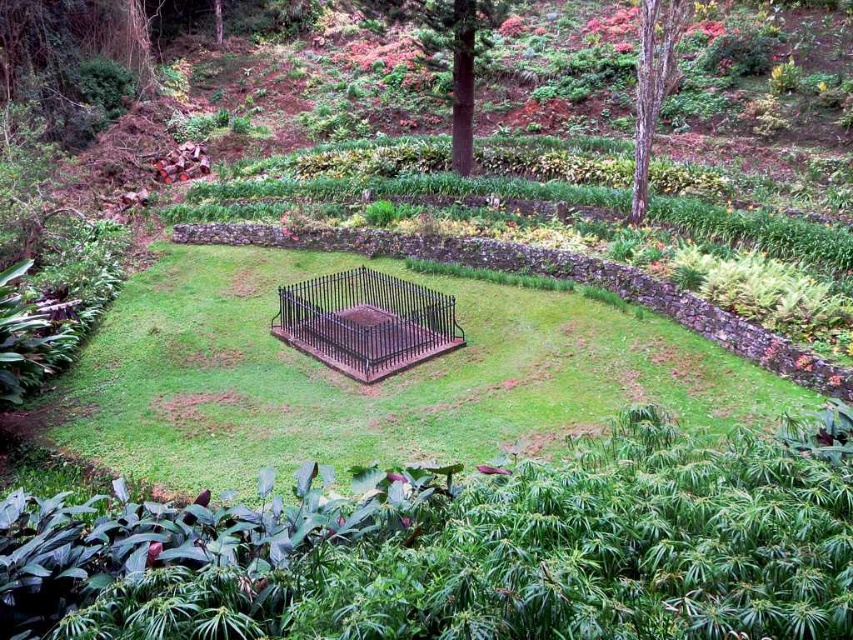
This screenshot has width=853, height=640. I want to click on green leafy plants at lower center, so click(463, 547).

From the picture: Is green leafy plants at lower center to the right of green grassy area at center from the viewer's perspective?

Correct, you'll find green leafy plants at lower center to the right of green grassy area at center.

Describe the element at coordinates (463, 547) in the screenshot. This screenshot has height=640, width=853. I see `green leafy plants at lower center` at that location.

The height and width of the screenshot is (640, 853). Identify the location of green leafy plants at lower center. (463, 547).

Who is taller, black wrought iron bird cage at center or brown smooth tree at upper center?

Standing taller between the two is black wrought iron bird cage at center.

Locate an element on the screen. The height and width of the screenshot is (640, 853). black wrought iron bird cage at center is located at coordinates (366, 321).

Find the location of a particular element. Image resolution: width=853 pixels, height=640 pixels. black wrought iron bird cage at center is located at coordinates (366, 321).

Who is more distant from viewer, (471, 51) or (648, 90)?

The point (471, 51) is behind.

Between point (502, 8) and point (639, 204), which one is positioned in front?

Point (639, 204) is in front.

At what (x,y) coordinates should I click in order to perform the action: click on brown smooth tree at upper center. Please return your answer as a coordinate pair (x, y). This screenshot has width=853, height=640. Looking at the image, I should click on (459, 58).